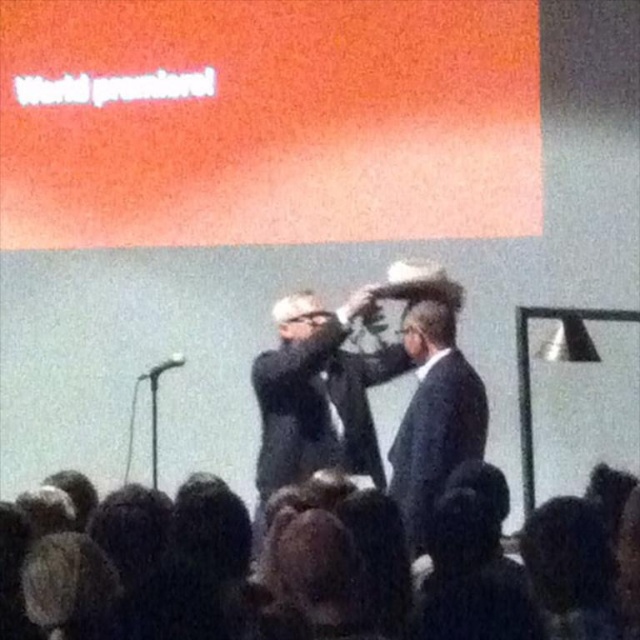
Does black suit at center appear over satin black suit at center?

Correct, black suit at center is located above satin black suit at center.

Find the location of a particular element. black suit at center is located at coordinates (316, 397).

This screenshot has width=640, height=640. Identify the location of black suit at center. (316, 397).

The height and width of the screenshot is (640, 640). Find the location of `black suit at center`. black suit at center is located at coordinates (316, 397).

Describe the element at coordinates (208, 576) in the screenshot. I see `dark hair at lower center` at that location.

Which of these two, dark hair at lower center or black suit at center, stands shorter?

dark hair at lower center is shorter.

Image resolution: width=640 pixels, height=640 pixels. I want to click on dark hair at lower center, so click(x=208, y=576).

Image resolution: width=640 pixels, height=640 pixels. What do you see at coordinates (208, 576) in the screenshot?
I see `dark hair at lower center` at bounding box center [208, 576].

Does dark hair at lower center appear on the left side of satin black suit at center?

Yes, dark hair at lower center is to the left of satin black suit at center.

Which is in front, point (156, 605) or point (394, 458)?

Point (156, 605)

This screenshot has height=640, width=640. Identify the location of dark hair at lower center. (208, 576).